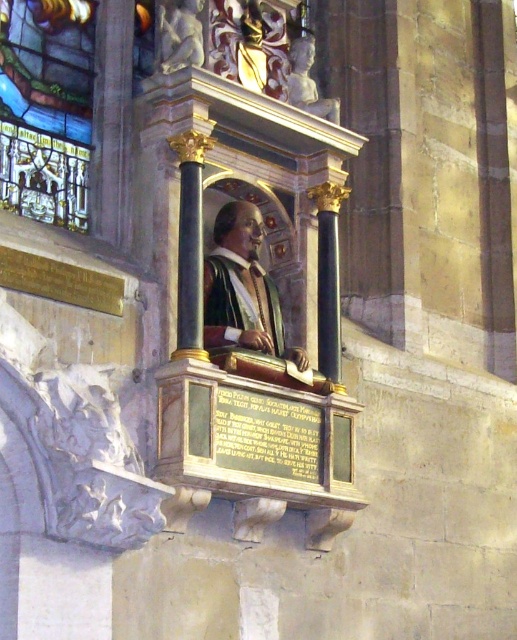
Is point (168, 13) positioned in front of point (291, 58)?

Yes, point (168, 13) is in front of point (291, 58).

Which is below, polished marble cherub at upper left or polished marble bust at upper center?

Positioned lower is polished marble bust at upper center.

This screenshot has width=517, height=640. I want to click on polished marble cherub at upper left, so click(x=179, y=35).

Identify the location of polished marble cherub at upper left. (179, 35).

Identify the location of stained glass window at upper left. Image resolution: width=517 pixels, height=640 pixels. [47, 108].

I want to click on stained glass window at upper left, so 47,108.

Is stained glass window at upper left bigger than matte gold robe at center?

Indeed, stained glass window at upper left has a larger size compared to matte gold robe at center.

Does stained glass window at upper left have a greater width compared to matte gold robe at center?

Yes.

Is point (22, 208) positioned in front of point (231, 296)?

That is True.

At what (x,y) coordinates should I click in order to perform the action: click on stained glass window at upper left. Please return your answer as a coordinate pair (x, y). Image resolution: width=517 pixels, height=640 pixels. Looking at the image, I should click on (47, 108).